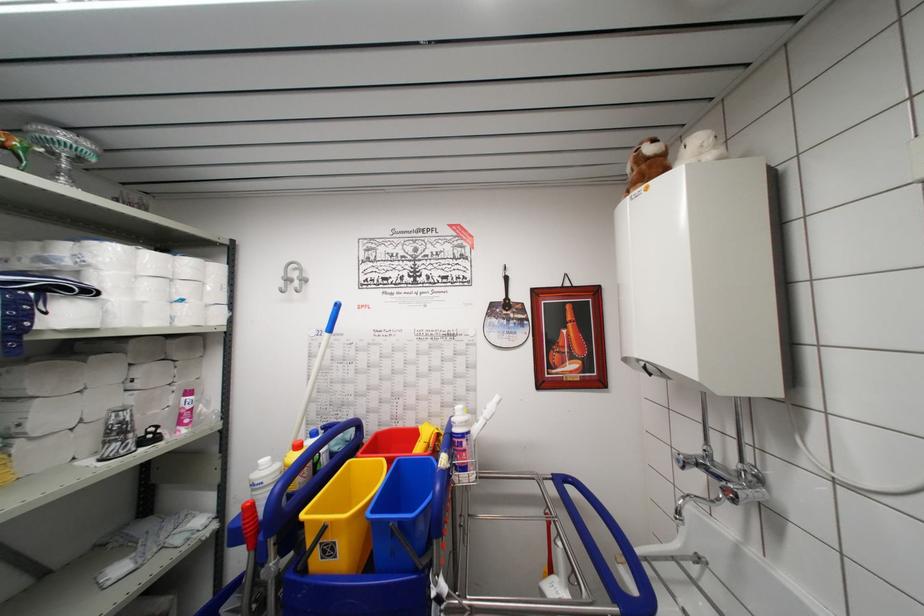
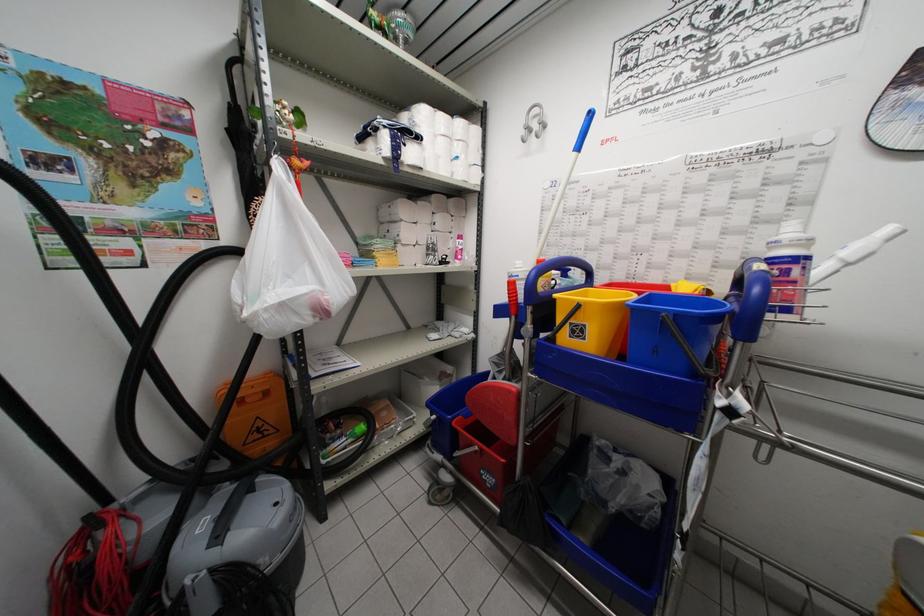
The first image is from the beginning of the video and the second image is from the end. How did the camera likely rotate when shooting the video?

The rotation direction of the camera is left-down.